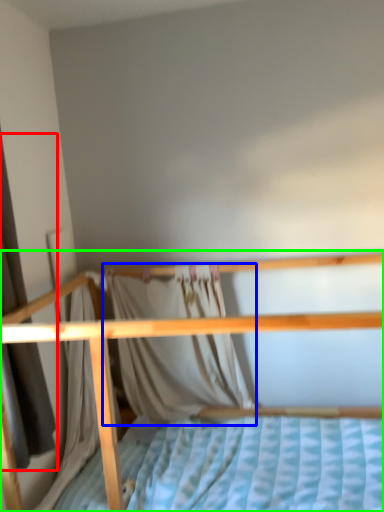
Question: Considering the real-world distances, which object is closest to curtain (highlighted by a red box)? curtain (highlighted by a blue box) or bed (highlighted by a green box).

Choices:
 (A) curtain
 (B) bed

Answer: (B)